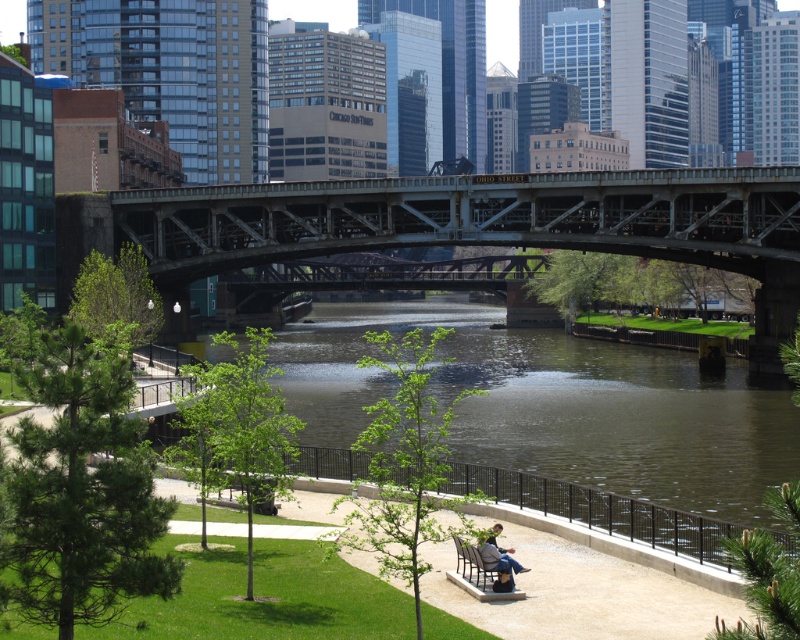
Can you confirm if green water at center is taller than denim jeans at lower center?

Correct, green water at center is much taller as denim jeans at lower center.

Who is positioned more to the left, green water at center or denim jeans at lower center?

green water at center is more to the left.

Between point (316, 396) and point (500, 588), which one is positioned in front?

Point (500, 588) is more forward.

The height and width of the screenshot is (640, 800). I want to click on green water at center, so click(x=558, y=417).

Between green water at center and metallic gray bridge at center, which one is positioned higher?

metallic gray bridge at center is higher up.

Which of these two, green water at center or metallic gray bridge at center, stands shorter?

With less height is green water at center.

Find the location of `green water at center`. green water at center is located at coordinates (558, 417).

Image resolution: width=800 pixels, height=640 pixels. In order to click on metallic gray bridge at center in this screenshot , I will do `click(486, 221)`.

Image resolution: width=800 pixels, height=640 pixels. Describe the element at coordinates (486, 221) in the screenshot. I see `metallic gray bridge at center` at that location.

Does point (409, 218) come closer to viewer compared to point (450, 573)?

No, it is not.

Locate an element on the screen. metallic gray bridge at center is located at coordinates (486, 221).